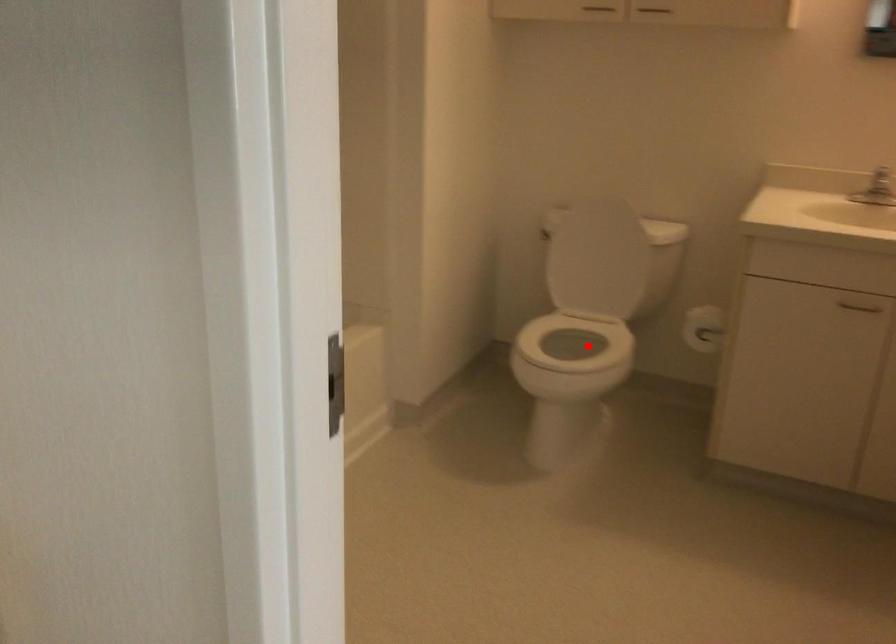
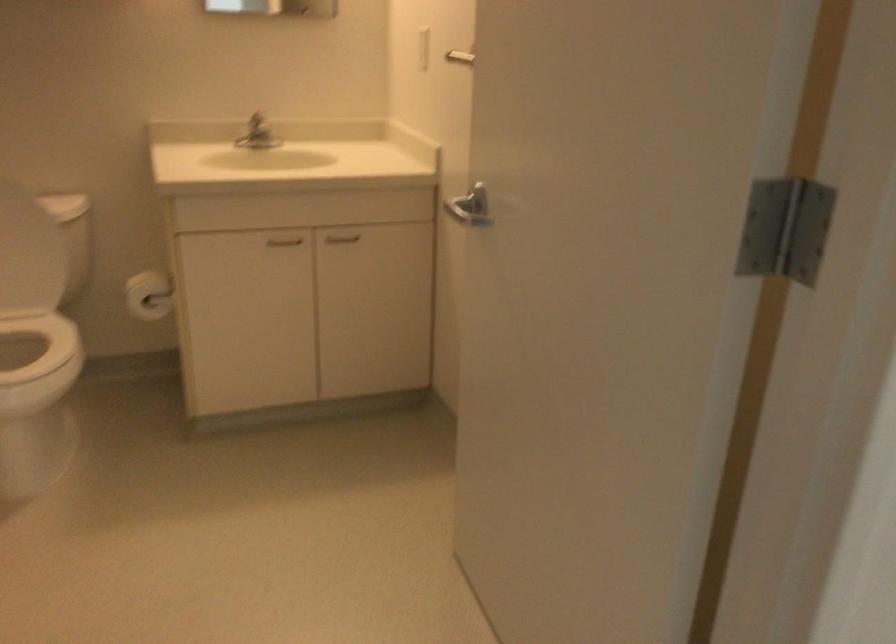
Question: I am providing you with two images of the same scene from different viewpoints. In image1, a red point is highlighted. Considering the same 3D point in image2, which of the following is correct?

Choices:
 (A) It is closer
 (B) It is farther

Answer: (A)